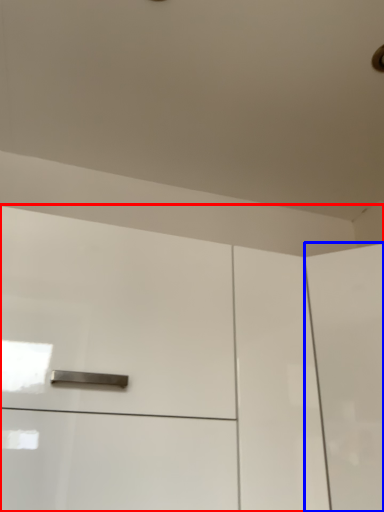
Question: Among these objects, which one is nearest to the camera, cabinetry (highlighted by a red box) or screen door (highlighted by a blue box)?

Choices:
 (A) cabinetry
 (B) screen door

Answer: (A)